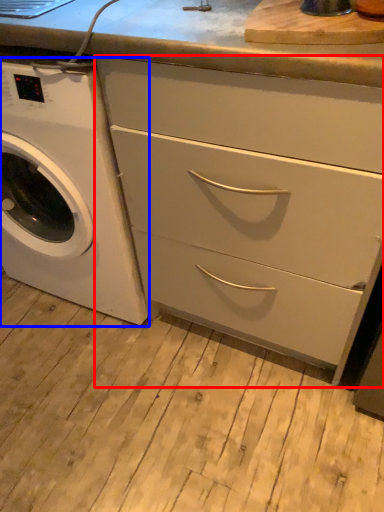
Question: Among these objects, which one is farthest to the camera, chest of drawers (highlighted by a red box) or washing machine (highlighted by a blue box)?

Choices:
 (A) chest of drawers
 (B) washing machine

Answer: (B)